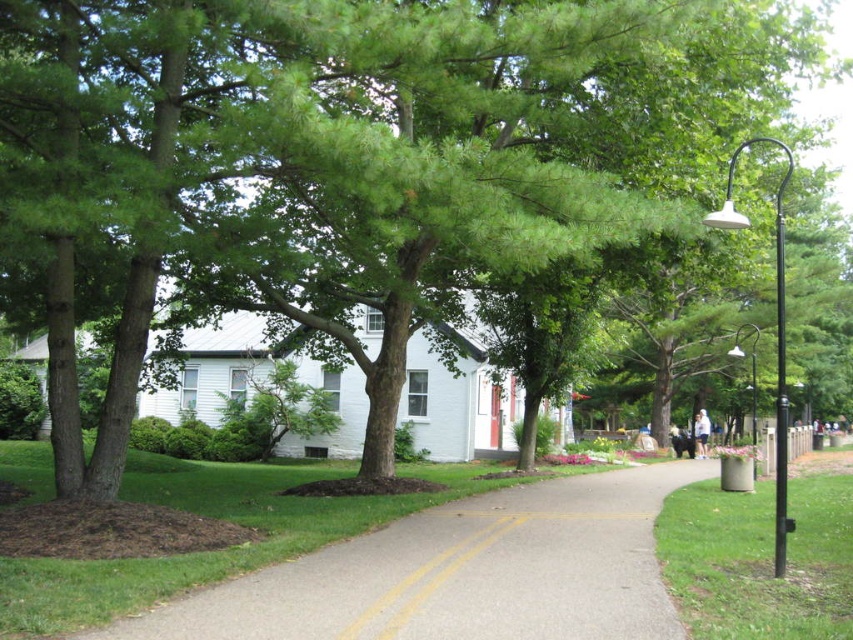
You are standing at the starting point of the pathway and want to reach the end. There are two points marked on the path. Which point should you reach first, point (264, 572) or point (344, 628)?

You should reach point (344, 628) first because point (264, 572) is behind it on the pathway.

You are a delivery person with a 1.5 meter wide cart. You need to navigate through the gray asphalt pavement at center and the black metal lamp post at right. Can your cart fit through the space between them?

The gray asphalt pavement at center has a smaller size compared to black metal lamp post at right, but the question is about fitting through the space between them. Since the description only compares their sizes, not the available space, we cannot determine if the cart will fit. More information about the distance between them is needed.